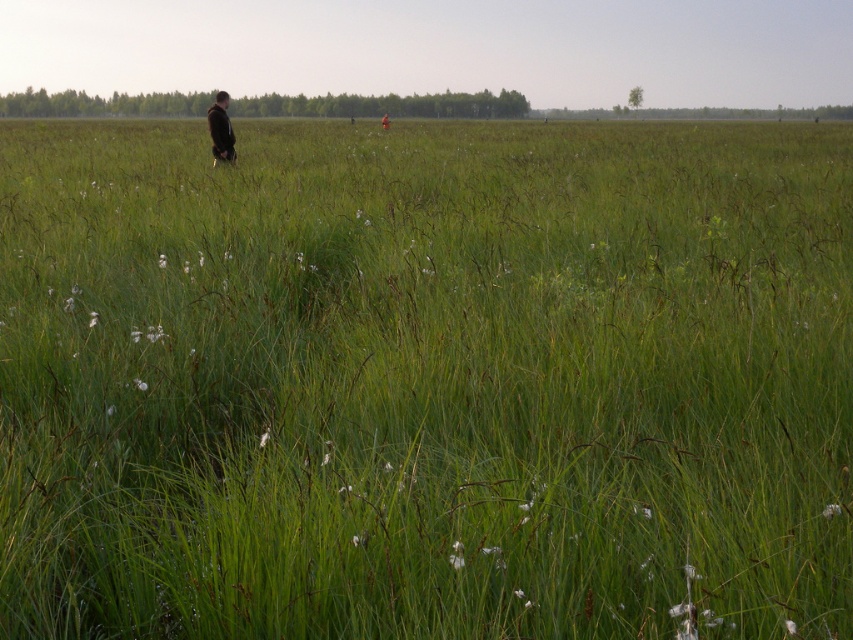
Does black matte jacket at center appear over dark brown leather jacket at center?

Incorrect, black matte jacket at center is not positioned above dark brown leather jacket at center.

Can you confirm if black matte jacket at center is positioned to the left of dark brown leather jacket at center?

Indeed, black matte jacket at center is positioned on the left side of dark brown leather jacket at center.

Describe the element at coordinates (219, 129) in the screenshot. This screenshot has width=853, height=640. I see `black matte jacket at center` at that location.

Locate an element on the screen. The width and height of the screenshot is (853, 640). black matte jacket at center is located at coordinates (219, 129).